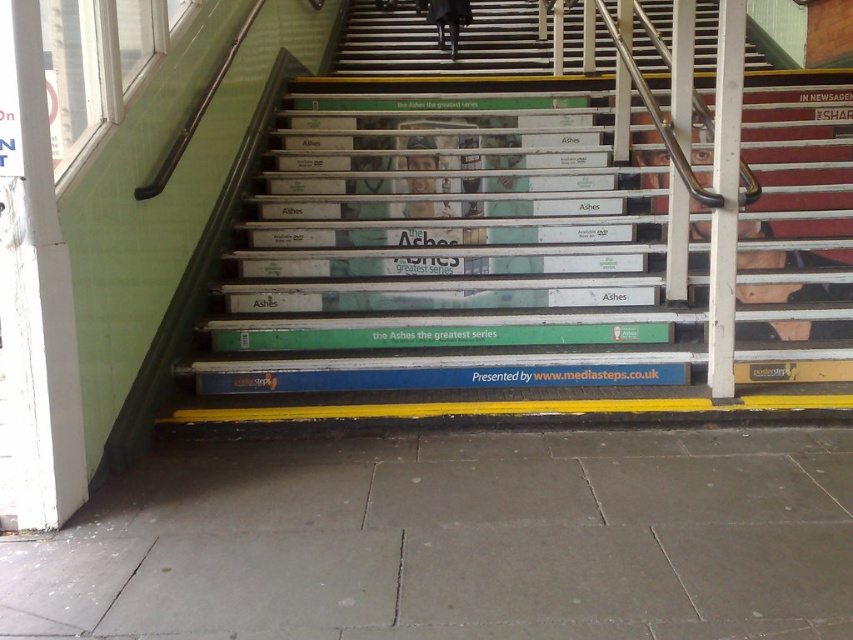
Which is behind, point (657, 20) or point (468, 4)?

The point (657, 20) is behind.

Locate an element on the screen. The image size is (853, 640). white painted wood stairs at upper center is located at coordinates (445, 42).